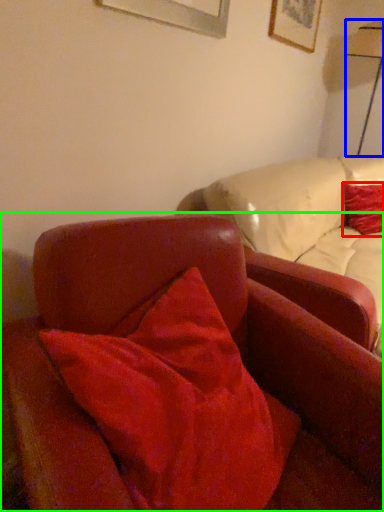
Question: Which is nearer to the pillow (highlighted by a red box)? table lamp (highlighted by a blue box) or chair (highlighted by a green box).

Choices:
 (A) table lamp
 (B) chair

Answer: (A)